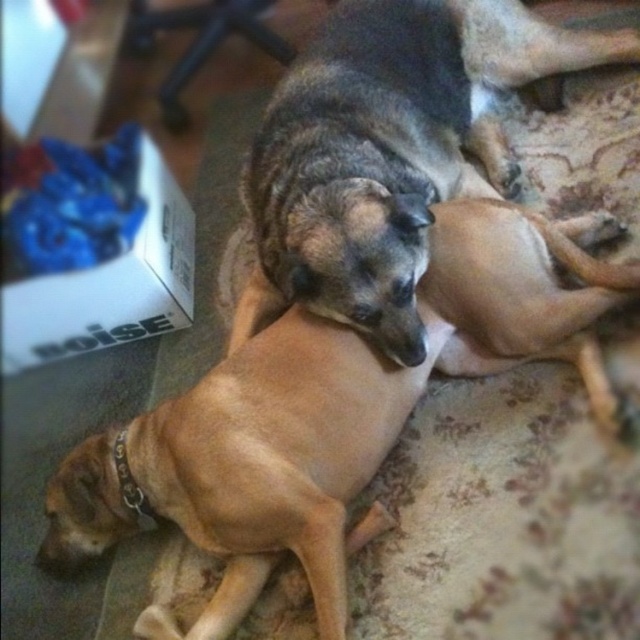
You are a dog trainer assessing the space needed for two dogs. Given the brown smooth dog at lower left and the brown fur dog at center, which one requires more horizontal space to lie comfortably?

The brown smooth dog at lower left requires more horizontal space because its width surpasses that of the brown fur dog at center.

You are a dog trainer observing two dogs on a carpet. You see the brown smooth dog at lower left and the brown fur dog at center. Which dog is positioned lower on the carpet?

The brown smooth dog at lower left is positioned lower on the carpet than the brown fur dog at center because it is below it.